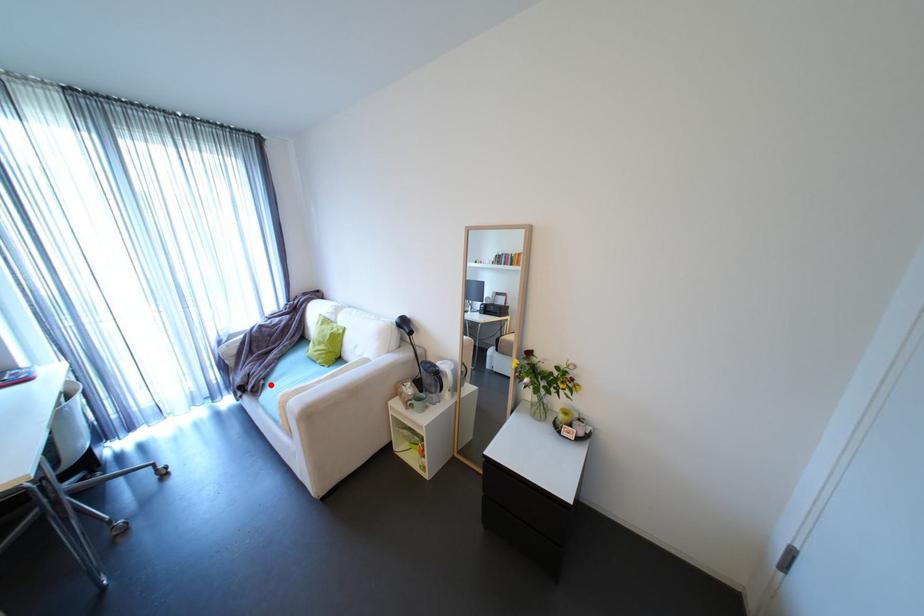
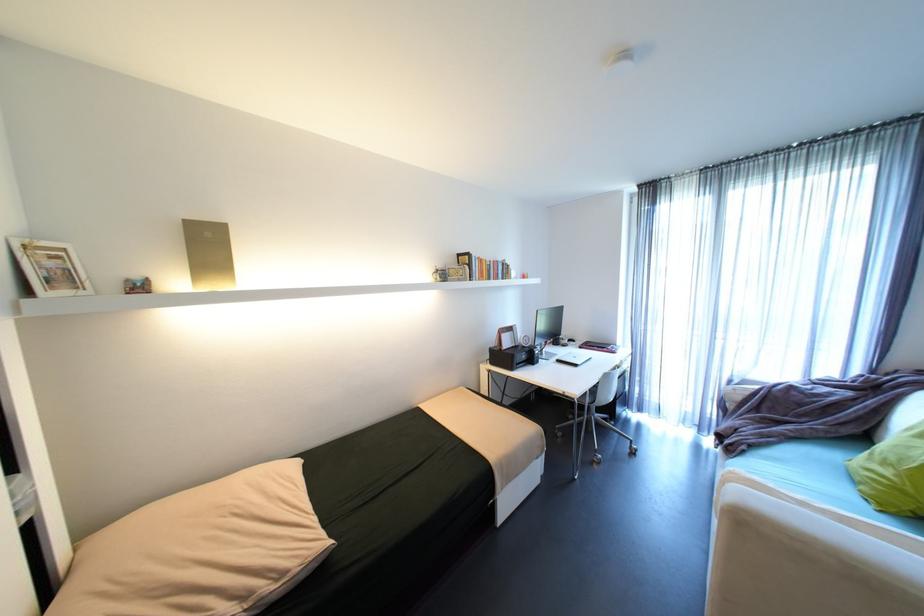
Where in the second image is the point corresponding to the highlighted location from the first image?

(751, 451)